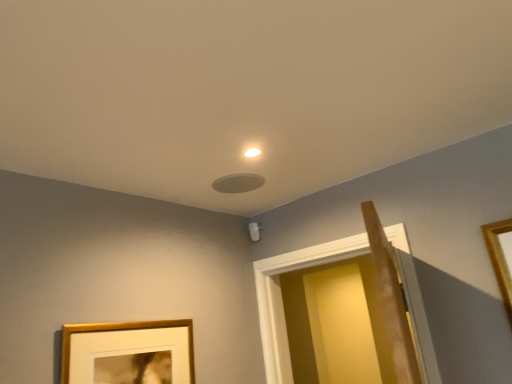
Image resolution: width=512 pixels, height=384 pixels. What do you see at coordinates (128, 353) in the screenshot?
I see `wooden framed picture at lower left` at bounding box center [128, 353].

At what (x,y) coordinates should I click in order to perform the action: click on wooden framed picture at lower left. Please return your answer as a coordinate pair (x, y). Looking at the image, I should click on (128, 353).

Locate an element on the screen. The height and width of the screenshot is (384, 512). wooden framed picture at lower left is located at coordinates (128, 353).